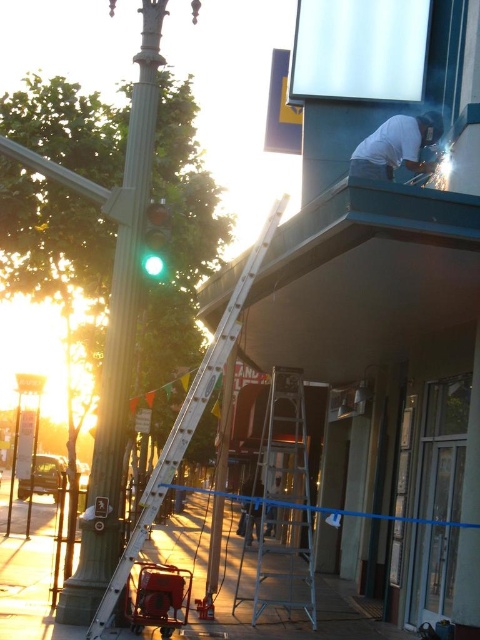
Measure the distance between green polished metal pole at left and silver metallic ladder at center.

The distance of green polished metal pole at left from silver metallic ladder at center is 6.81 meters.

I want to click on green polished metal pole at left, so click(118, 342).

Between white aluminum ladder at center and green glass traffic light at center-left, which one is positioned lower?

white aluminum ladder at center is below.

Between point (208, 376) and point (158, 218), which one is positioned behind?

Point (158, 218)

Locate an element on the screen. The height and width of the screenshot is (640, 480). white aluminum ladder at center is located at coordinates (187, 420).

Who is more forward, (399,164) or (160,269)?

Point (160,269) is more forward.

Can you confirm if white matte shirt at upper center is wider than green glass traffic light at center-left?

Indeed, white matte shirt at upper center has a greater width compared to green glass traffic light at center-left.

Is point (368, 148) in front of point (155, 236)?

No, it is not.

Find the location of a particular element. white matte shirt at upper center is located at coordinates (396, 147).